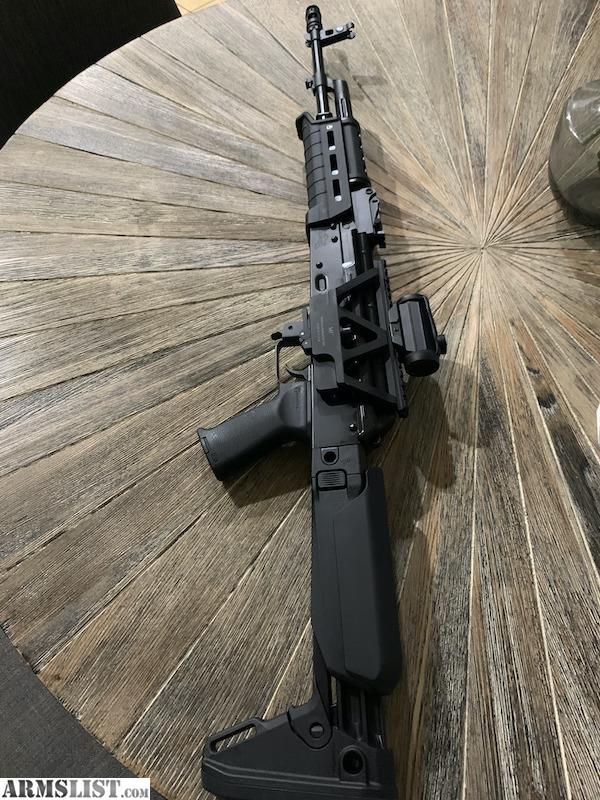
Image resolution: width=600 pixels, height=800 pixels. Find the location of `table`. table is located at coordinates (149, 333).